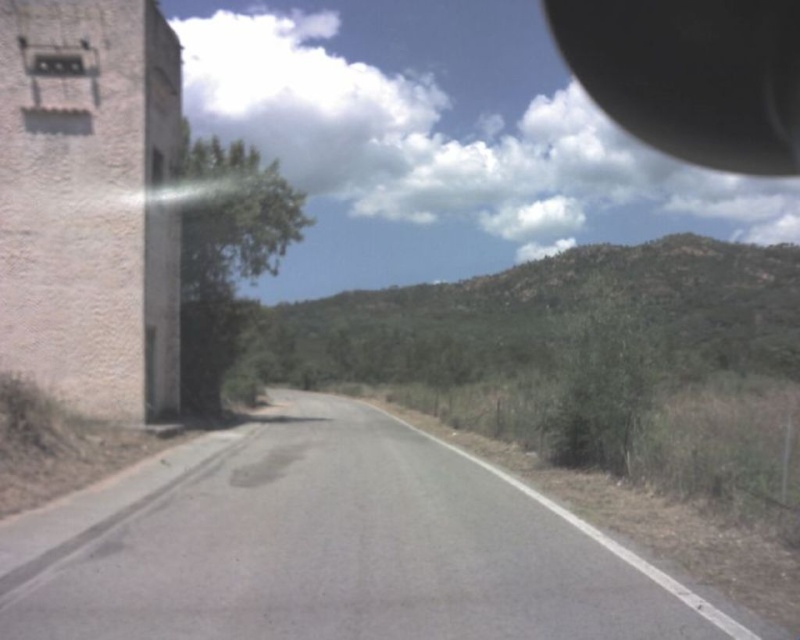
In order to click on gray asphalt road at center in this screenshot , I will do `click(330, 547)`.

Does gray asphalt road at center have a greater height compared to black rubber view mirror at upper right?

No, gray asphalt road at center is not taller than black rubber view mirror at upper right.

This screenshot has height=640, width=800. Describe the element at coordinates (330, 547) in the screenshot. I see `gray asphalt road at center` at that location.

Where is `gray asphalt road at center`? The image size is (800, 640). gray asphalt road at center is located at coordinates (330, 547).